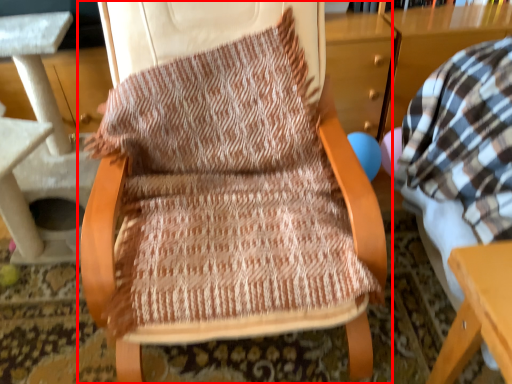
Question: From the image's perspective, what is the correct spatial relationship of chair (annotated by the red box) in relation to table?

Choices:
 (A) above
 (B) below

Answer: (B)